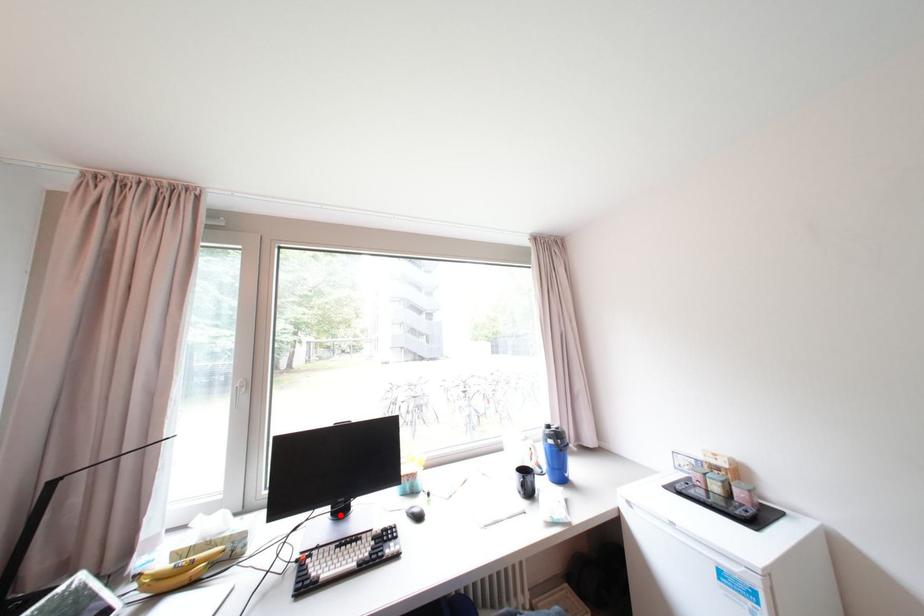
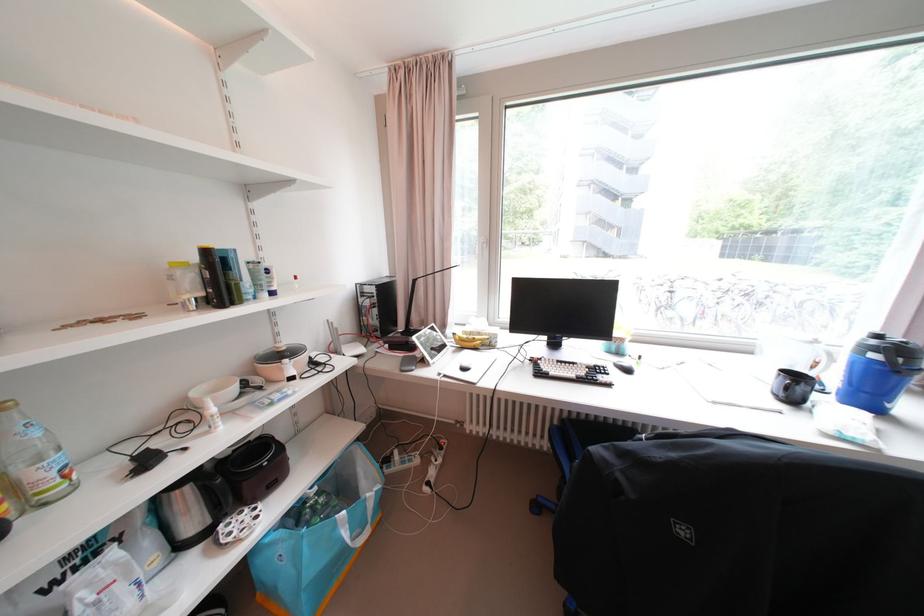
In the second image, find the point that corresponds to the highlighted location in the first image.

(555, 346)